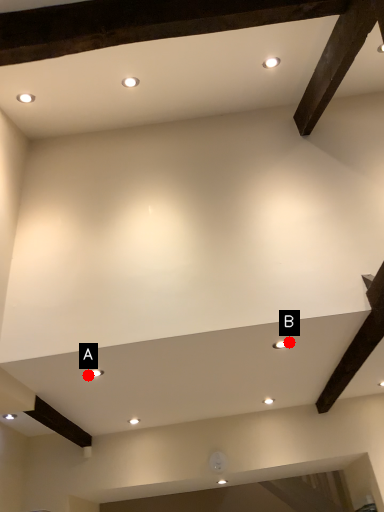
Question: Two points are circled on the image, labeled by A and B beside each circle. Which point is farther from the camera taking this photo?

Choices:
 (A) A is further
 (B) B is further

Answer: (A)